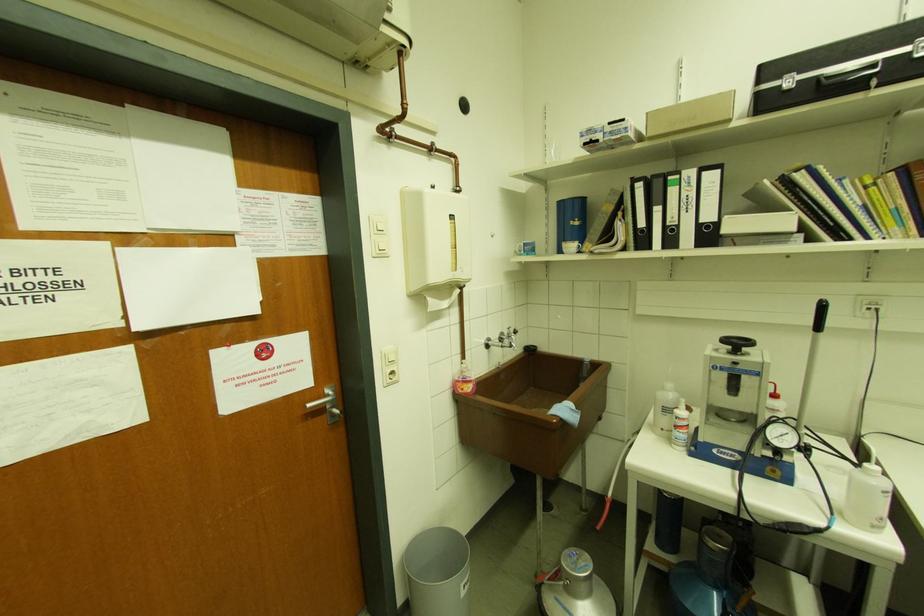
Identify the location of black case handle. (848, 79).